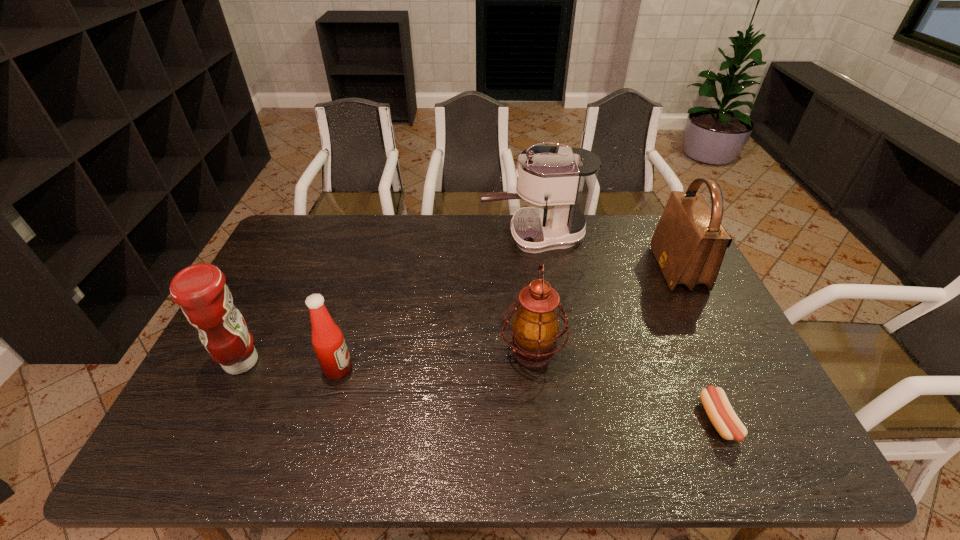
The width and height of the screenshot is (960, 540). I want to click on coffee maker, so click(x=564, y=178).

The width and height of the screenshot is (960, 540). Identify the location of shoulder bag. (689, 243).

Locate an element on the screen. The image size is (960, 540). oil lamp is located at coordinates (535, 327).

Where is `the left condiment`? The image size is (960, 540). the left condiment is located at coordinates (200, 289).

In order to click on the second object from left to right in this screenshot , I will do `click(329, 344)`.

The height and width of the screenshot is (540, 960). I want to click on the right condiment, so click(x=329, y=344).

Identify the location of the nearest object. point(715,402).

The image size is (960, 540). Find the location of `sausage`. sausage is located at coordinates (715, 402).

You are a GUI agent. You are given a task and a screenshot of the screen. Output one action in this format:
    pyautogui.click(x=<x>, y=<y>)
    Task: Click on the vacant space located on the front-facing side of the coffee maker
    The height and width of the screenshot is (540, 960).
    Given the screenshot: What is the action you would take?
    pyautogui.click(x=452, y=237)

At what (x,y) coordinates should I click in order to perform the action: click on free point located 0.320m on the front-facing side of the coffee maker. Please return your answer as a coordinate pair (x, y). The height and width of the screenshot is (540, 960). Looking at the image, I should click on (391, 237).